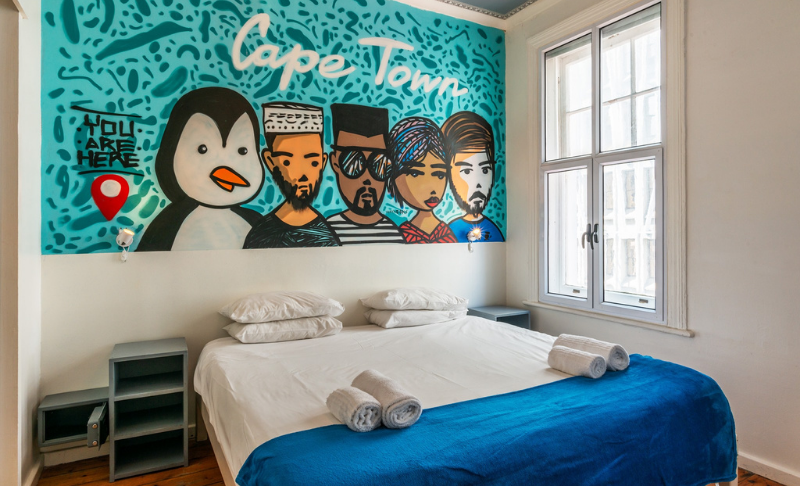
This screenshot has width=800, height=486. I want to click on pillow, so click(300, 335).